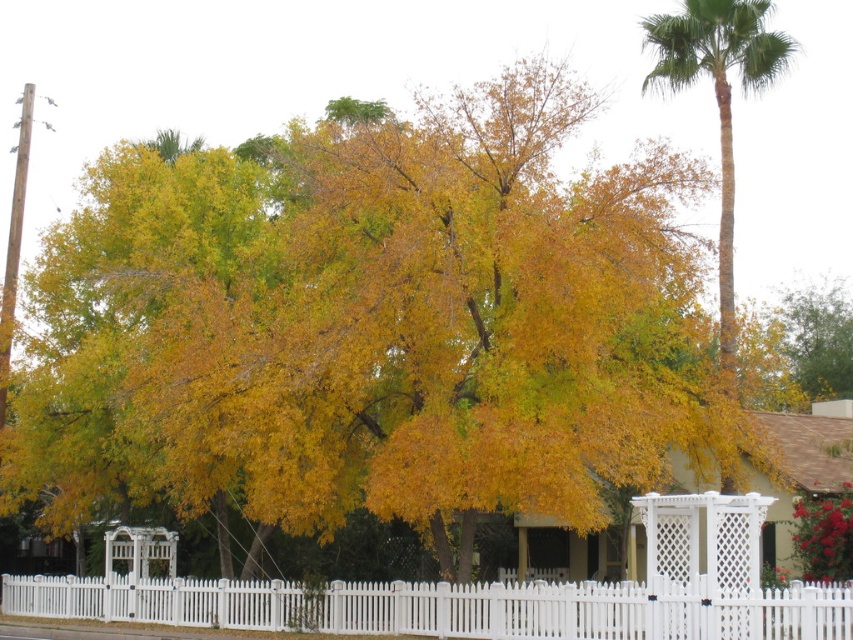
Based on the scene description, where is the white picket fence at center located in terms of coordinates?

The white picket fence at center is located at coordinates point (447,605).

You are standing at the point closest to the viewer in the image. There are two points marked in the scene, one at coordinates point (651, 586) and the other at point (724, 225). Which point are you standing at?

You are standing at point (651, 586) because it is in front of point (724, 225), making it closer to the viewer.